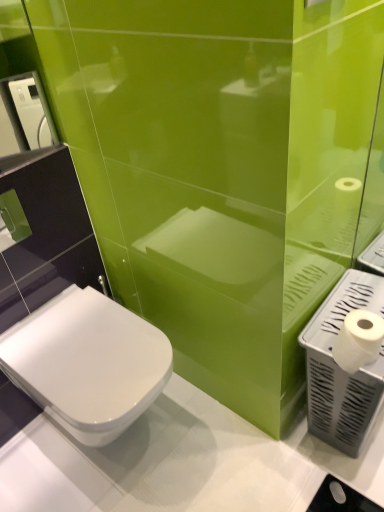
Question: Should I look upward or downward to see white plastic hand dryer at right, the 1th hand dryer from the right?

Choices:
 (A) up
 (B) down

Answer: (B)

Question: From the image's perspective, would you say white glossy toilet at lower left is positioned over white matte toilet paper at right?

Choices:
 (A) yes
 (B) no

Answer: (B)

Question: From a real-world perspective, is white glossy toilet at lower left over white matte toilet paper at right?

Choices:
 (A) yes
 (B) no

Answer: (B)

Question: Is white glossy toilet at lower left next to white matte toilet paper at right and touching it?

Choices:
 (A) yes
 (B) no

Answer: (B)

Question: Is white glossy toilet at lower left shorter than white matte toilet paper at right?

Choices:
 (A) yes
 (B) no

Answer: (B)

Question: Is white glossy toilet at lower left to the right of white matte toilet paper at right from the viewer's perspective?

Choices:
 (A) yes
 (B) no

Answer: (B)

Question: Is white glossy toilet at lower left located outside white matte toilet paper at right?

Choices:
 (A) no
 (B) yes

Answer: (B)

Question: Is white plastic hand dryer at right, the first hand dryer in the bottom-to-top sequence, shorter than white glossy toilet at lower left?

Choices:
 (A) yes
 (B) no

Answer: (B)

Question: Is white plastic hand dryer at right, the first hand dryer in the bottom-to-top sequence, to the left of white glossy toilet at lower left from the viewer's perspective?

Choices:
 (A) no
 (B) yes

Answer: (A)

Question: Does white plastic hand dryer at right, the 1th hand dryer from the right, come in front of white glossy toilet at lower left?

Choices:
 (A) no
 (B) yes

Answer: (A)

Question: From the image's perspective, would you say white plastic hand dryer at right, the 1th hand dryer from the right, is positioned over white glossy toilet at lower left?

Choices:
 (A) no
 (B) yes

Answer: (B)

Question: From the image's perspective, is white plastic hand dryer at right, the first hand dryer in the bottom-to-top sequence, beneath white glossy toilet at lower left?

Choices:
 (A) no
 (B) yes

Answer: (A)

Question: Is white plastic hand dryer at right, the 1th hand dryer from the right, to the right of white glossy toilet at lower left from the viewer's perspective?

Choices:
 (A) yes
 (B) no

Answer: (A)

Question: Does white plastic hand dryer at upper left, the second hand dryer from the right, come behind white matte toilet paper at right?

Choices:
 (A) no
 (B) yes

Answer: (B)